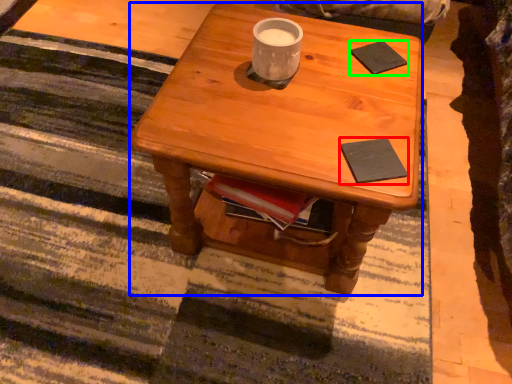
Question: Estimate the real-world distances between objects in this image. Which object is closer to pad (highlighted by a red box), desk (highlighted by a blue box) or pad (highlighted by a green box)?

Choices:
 (A) desk
 (B) pad

Answer: (A)